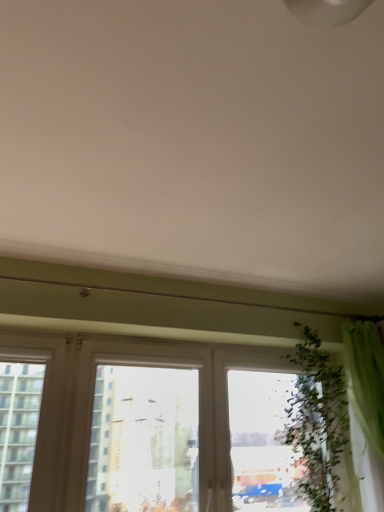
Question: From the image's perspective, is transparent glass window at center above green fabric curtain at right?

Choices:
 (A) no
 (B) yes

Answer: (A)

Question: Does transparent glass window at center appear on the right side of green fabric curtain at right?

Choices:
 (A) no
 (B) yes

Answer: (A)

Question: Considering the relative positions of transparent glass window at center and green fabric curtain at right in the image provided, is transparent glass window at center to the left of green fabric curtain at right from the viewer's perspective?

Choices:
 (A) no
 (B) yes

Answer: (B)

Question: Considering the relative sizes of transparent glass window at center and green fabric curtain at right in the image provided, is transparent glass window at center bigger than green fabric curtain at right?

Choices:
 (A) no
 (B) yes

Answer: (B)

Question: Would you say transparent glass window at center is outside green fabric curtain at right?

Choices:
 (A) yes
 (B) no

Answer: (A)

Question: From the image's perspective, is green fabric curtain at right positioned above or below green leafy plant at right?

Choices:
 (A) below
 (B) above

Answer: (B)

Question: Is green fabric curtain at right inside the boundaries of green leafy plant at right, or outside?

Choices:
 (A) inside
 (B) outside

Answer: (B)

Question: Considering the positions of point (382, 482) and point (321, 482), is point (382, 482) closer or farther from the camera than point (321, 482)?

Choices:
 (A) farther
 (B) closer

Answer: (B)

Question: Is green fabric curtain at right taller or shorter than green leafy plant at right?

Choices:
 (A) short
 (B) tall

Answer: (B)

Question: Considering the positions of green leafy plant at right and green fabric curtain at right in the image, is green leafy plant at right bigger or smaller than green fabric curtain at right?

Choices:
 (A) small
 (B) big

Answer: (A)

Question: In terms of width, does green leafy plant at right look wider or thinner when compared to green fabric curtain at right?

Choices:
 (A) thin
 (B) wide

Answer: (B)

Question: From a real-world perspective, relative to green fabric curtain at right, is green leafy plant at right vertically above or below?

Choices:
 (A) above
 (B) below

Answer: (B)

Question: Considering the positions of green leafy plant at right and green fabric curtain at right in the image, is green leafy plant at right taller or shorter than green fabric curtain at right?

Choices:
 (A) tall
 (B) short

Answer: (B)

Question: From the image's perspective, is transparent glass window at center above or below green fabric curtain at right?

Choices:
 (A) above
 (B) below

Answer: (B)

Question: Is point (140, 425) closer or farther from the camera than point (349, 359)?

Choices:
 (A) closer
 (B) farther

Answer: (A)